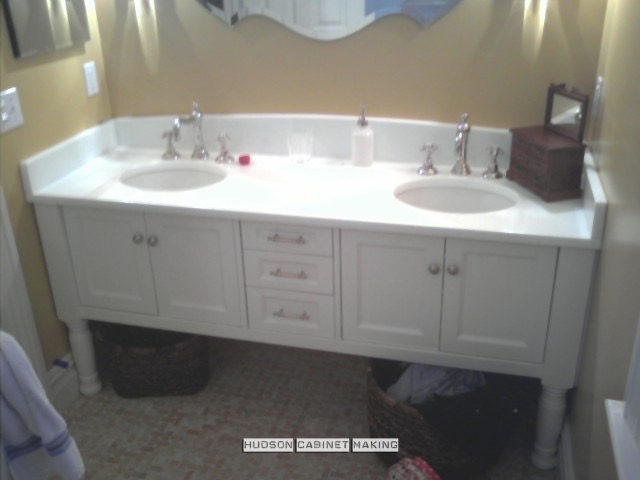
Where is `towel`? towel is located at coordinates (41, 416).